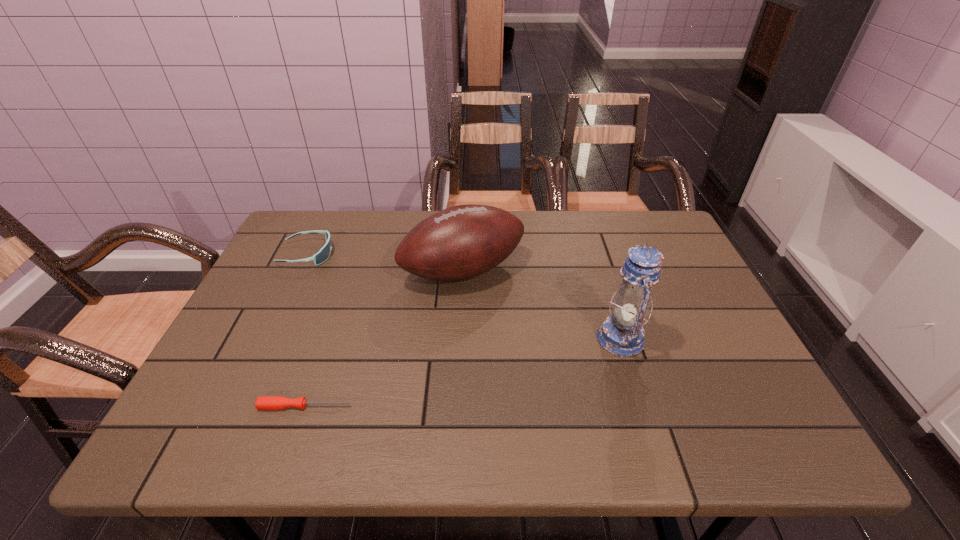
Locate an element on the screen. vacant space that is in between the shortest object and the rightmost object is located at coordinates (463, 372).

The height and width of the screenshot is (540, 960). I want to click on vacant area that lies between the second shortest object and the screwdriver, so click(x=306, y=330).

The image size is (960, 540). In order to click on unoccupied position between the goggles and the rightmost object in this screenshot , I will do `click(464, 296)`.

This screenshot has height=540, width=960. Identify the location of free space between the screwdriver and the rightmost object. (463, 372).

I want to click on vacant point located between the shortest object and the third tallest object, so click(x=306, y=330).

At what (x,y) coordinates should I click in order to perform the action: click on empty location between the third shortest object and the nearest object. Please return your answer as a coordinate pair (x, y). Looking at the image, I should click on (384, 339).

Locate an element on the screen. Image resolution: width=960 pixels, height=540 pixels. object that is the closest to the third shortest object is located at coordinates (622, 334).

Choose which object is the third nearest neighbor to the lantern. Please provide its 2D coordinates. Your answer should be formatted as a tuple, i.e. [(x, y)], where the tuple contains the x and y coordinates of a point satisfying the conditions above.

[(324, 253)]

This screenshot has height=540, width=960. I want to click on free space that satisfies the following two spatial constraints: 1. on the back side of the football (American); 2. on the front-facing side of the third tallest object, so click(x=464, y=254).

What are the coordinates of `vacant region that satisfies the following two spatial constraints: 1. on the back side of the third object from left to right; 2. on the front-facing side of the third tallest object` in the screenshot? It's located at (464, 254).